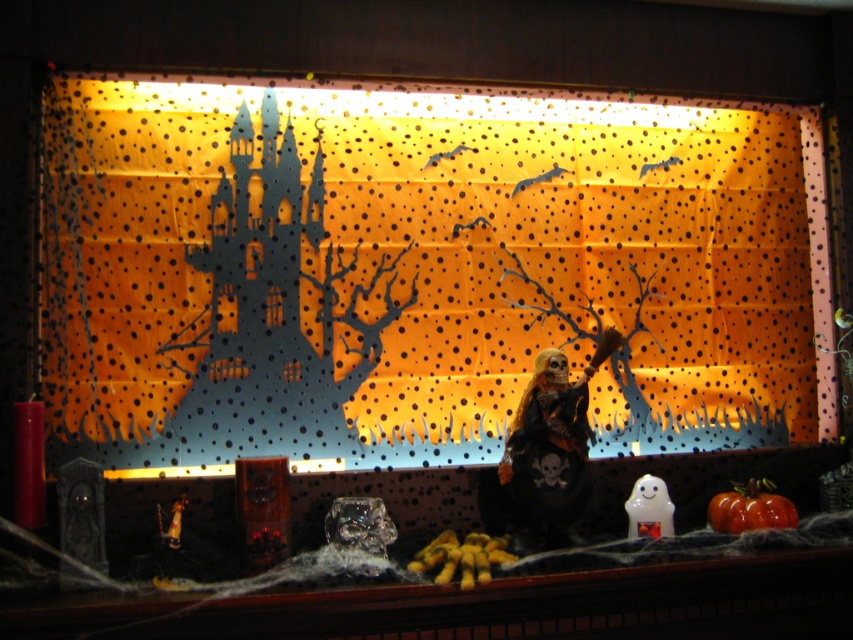
What do you see at coordinates (418, 269) in the screenshot?
I see `matte black skeleton at center` at bounding box center [418, 269].

Who is shorter, matte black skeleton at center or orange matte pumpkin at lower right?

orange matte pumpkin at lower right is shorter.

The height and width of the screenshot is (640, 853). I want to click on matte black skeleton at center, so click(x=418, y=269).